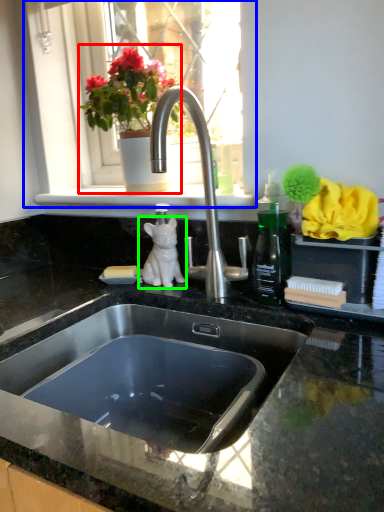
Question: Based on their relative distances, which object is farther from houseplant (highlighted by a red box)? Choose from window (highlighted by a blue box) and animal (highlighted by a green box).

Choices:
 (A) window
 (B) animal

Answer: (B)